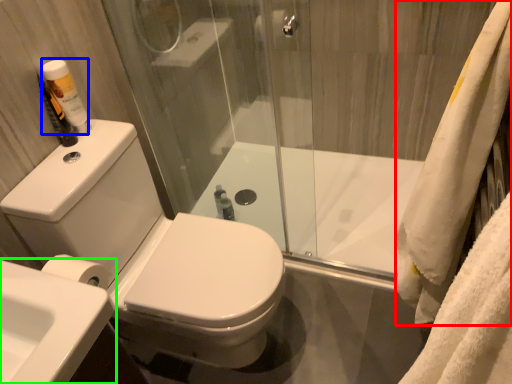
Question: Estimate the real-world distances between objects in this image. Which object is closer to bath towel (highlighted by a red box), toiletry (highlighted by a blue box) or sink (highlighted by a green box)?

Choices:
 (A) toiletry
 (B) sink

Answer: (B)